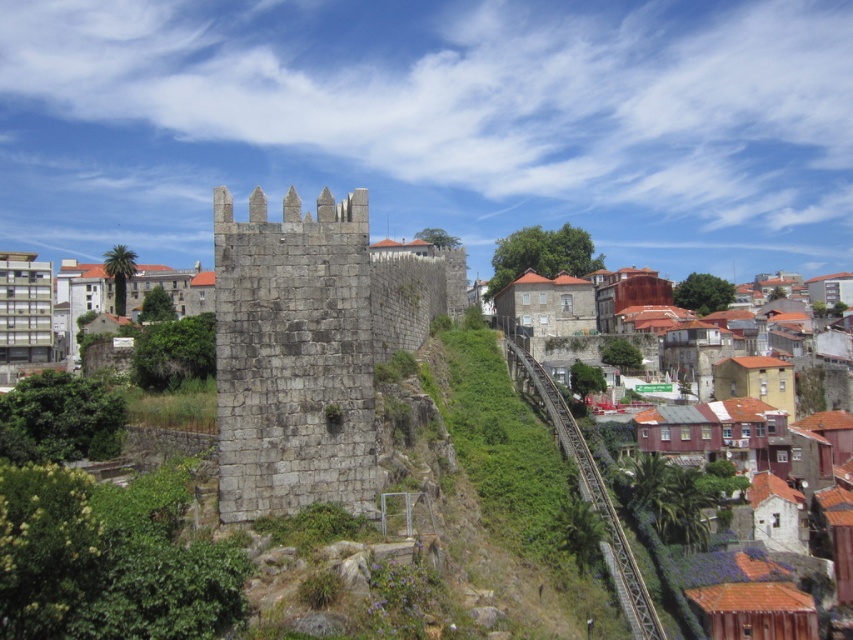
Can you confirm if gray stone wall at center is thinner than brown textured buildings at center-right?

Correct, gray stone wall at center's width is less than brown textured buildings at center-right's.

Can you confirm if gray stone wall at center is taller than brown textured buildings at center-right?

No.

Is point (320, 436) closer to camera compared to point (648, 276)?

Yes.

In order to click on gray stone wall at center in this screenshot , I will do `click(306, 349)`.